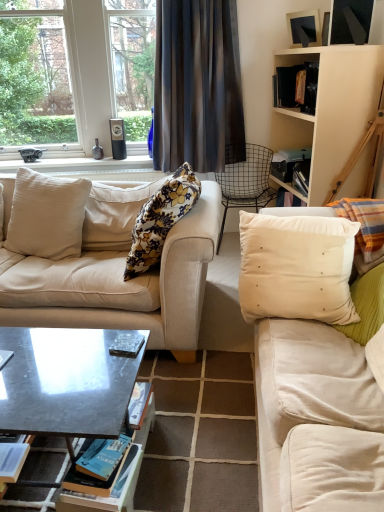
Where is `free spot to the left of wooden book at center, the third book positioned from the bottom`? The image size is (384, 512). free spot to the left of wooden book at center, the third book positioned from the bottom is located at coordinates (78, 350).